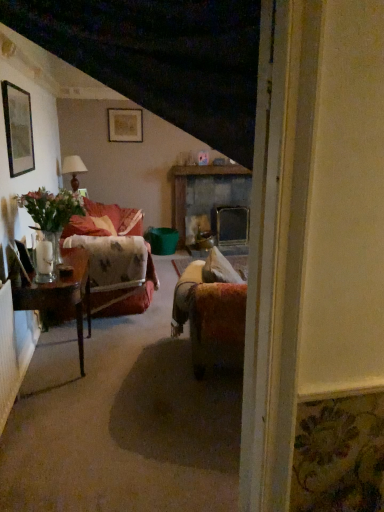
This screenshot has width=384, height=512. What do you see at coordinates (125, 125) in the screenshot?
I see `matte gold picture frame at upper center, which is the 2th picture frame from front to back` at bounding box center [125, 125].

What is the approximate width of velvet floral couch at left?

velvet floral couch at left is 3.74 feet wide.

The image size is (384, 512). What do you see at coordinates (206, 194) in the screenshot? I see `rustic stone fireplace at center` at bounding box center [206, 194].

Find the location of a particular element. This screenshot has width=384, height=512. wooden glossy table at left is located at coordinates (61, 294).

Is matte brown lamp at upper left not inside matte gold picture frame at upper center, arranged as the 2th picture frame when ordered from the bottom?

Yes, matte brown lamp at upper left is outside of matte gold picture frame at upper center, arranged as the 2th picture frame when ordered from the bottom.

Between matte brown lamp at upper left and matte gold picture frame at upper center, placed as the 1th picture frame when sorted from top to bottom, which one has less height?

matte gold picture frame at upper center, placed as the 1th picture frame when sorted from top to bottom.

From a real-world perspective, is matte brown lamp at upper left located beneath matte gold picture frame at upper center, which is the first picture frame from right to left?

Yes, from a real-world perspective, matte brown lamp at upper left is beneath matte gold picture frame at upper center, which is the first picture frame from right to left.

How many degrees apart are the facing directions of matte brown lamp at upper left and matte gold picture frame at upper center, the second picture frame positioned from the left?

88.8 degrees.

Is green matte picture frame at upper left, placed as the 1th picture frame when sorted from bottom to top, directly adjacent to matte gold picture frame at upper center, which is the first picture frame from right to left?

No, green matte picture frame at upper left, placed as the 1th picture frame when sorted from bottom to top, is not in contact with matte gold picture frame at upper center, which is the first picture frame from right to left.

Measure the distance from green matte picture frame at upper left, which is the first picture frame in left-to-right order, to matte gold picture frame at upper center, the second picture frame positioned from the left.

green matte picture frame at upper left, which is the first picture frame in left-to-right order, and matte gold picture frame at upper center, the second picture frame positioned from the left, are 2.89 meters apart from each other.

Which object is positioned more to the left, green matte picture frame at upper left, acting as the 1th picture frame starting from the front, or matte gold picture frame at upper center, arranged as the 2th picture frame when ordered from the bottom?

green matte picture frame at upper left, acting as the 1th picture frame starting from the front.

Based on the photo, is green matte picture frame at upper left, which appears as the 2th picture frame when viewed from the right, oriented towards matte gold picture frame at upper center, the second picture frame positioned from the left?

No.

At what (x,y) coordinates should I click in order to perform the action: click on lamp below the green matte picture frame at upper left, which is the first picture frame in left-to-right order (from a real-world perspective). Please return your answer as a coordinate pair (x, y). The width and height of the screenshot is (384, 512). Looking at the image, I should click on (73, 169).

From a real-world perspective, which object rests below the other?

From a 3D spatial view, matte brown lamp at upper left is below.

Does green matte picture frame at upper left, which is counted as the 2th picture frame, starting from the top, have a smaller size compared to matte brown lamp at upper left?

Yes, green matte picture frame at upper left, which is counted as the 2th picture frame, starting from the top, is smaller than matte brown lamp at upper left.

Which point is more distant from viewer, (19, 160) or (64, 162)?

The point (64, 162) is farther from the camera.

Is rustic stone fireplace at center facing towards green matte picture frame at upper left, which appears as the 2th picture frame when viewed from the right?

No, rustic stone fireplace at center is not aimed at green matte picture frame at upper left, which appears as the 2th picture frame when viewed from the right.

Is rustic stone fireplace at center directly adjacent to green matte picture frame at upper left, which ranks as the second picture frame in back-to-front order?

There is a gap between rustic stone fireplace at center and green matte picture frame at upper left, which ranks as the second picture frame in back-to-front order.

Does point (217, 191) lie behind point (25, 112)?

Yes, it is behind point (25, 112).

Consider the image. Is matte gold picture frame at upper center, which is the first picture frame from right to left, not within green matte picture frame at upper left, which ranks as the second picture frame in back-to-front order?

Yes.

Considering the relative positions of matte gold picture frame at upper center, the second picture frame positioned from the left, and green matte picture frame at upper left, which is the first picture frame in left-to-right order, in the image provided, is matte gold picture frame at upper center, the second picture frame positioned from the left, in front of green matte picture frame at upper left, which is the first picture frame in left-to-right order,?

No, matte gold picture frame at upper center, the second picture frame positioned from the left, is further to the viewer.

Considering the relative positions of matte gold picture frame at upper center, which ranks as the first picture frame in back-to-front order, and green matte picture frame at upper left, which is the first picture frame in left-to-right order, in the image provided, is matte gold picture frame at upper center, which ranks as the first picture frame in back-to-front order, to the right of green matte picture frame at upper left, which is the first picture frame in left-to-right order, from the viewer's perspective?

Yes.

Is rustic stone fireplace at center directly adjacent to matte gold picture frame at upper center, which is the 2th picture frame from front to back?

No, rustic stone fireplace at center is not next to matte gold picture frame at upper center, which is the 2th picture frame from front to back.

Who is more distant, rustic stone fireplace at center or matte gold picture frame at upper center, which is the first picture frame from right to left?

rustic stone fireplace at center is further away from the camera.

Considering the sizes of objects rustic stone fireplace at center and matte gold picture frame at upper center, which ranks as the first picture frame in back-to-front order, in the image provided, who is shorter, rustic stone fireplace at center or matte gold picture frame at upper center, which ranks as the first picture frame in back-to-front order,?

matte gold picture frame at upper center, which ranks as the first picture frame in back-to-front order, is shorter.

How different are the orientations of rustic stone fireplace at center and matte gold picture frame at upper center, which ranks as the first picture frame in back-to-front order, in degrees?

The angle between the facing direction of rustic stone fireplace at center and the facing direction of matte gold picture frame at upper center, which ranks as the first picture frame in back-to-front order, is 0.0081 degrees.

Is wooden glossy table at left not within green matte picture frame at upper left, which is counted as the 2th picture frame, starting from the top?

That's correct, wooden glossy table at left is outside of green matte picture frame at upper left, which is counted as the 2th picture frame, starting from the top.

Between wooden glossy table at left and green matte picture frame at upper left, which appears as the 2th picture frame when viewed from the right, which one has less height?

green matte picture frame at upper left, which appears as the 2th picture frame when viewed from the right, is shorter.

Can you see wooden glossy table at left touching green matte picture frame at upper left, which is counted as the 2th picture frame, starting from the top?

wooden glossy table at left and green matte picture frame at upper left, which is counted as the 2th picture frame, starting from the top, are not in contact.

Considering the relative sizes of wooden glossy table at left and green matte picture frame at upper left, acting as the 1th picture frame starting from the front, in the image provided, is wooden glossy table at left bigger than green matte picture frame at upper left, acting as the 1th picture frame starting from the front,?

Yes, wooden glossy table at left is bigger than green matte picture frame at upper left, acting as the 1th picture frame starting from the front.

Locate an element on the screen. picture frame behind the matte brown lamp at upper left is located at coordinates (125, 125).

Identify the location of picture frame that appears below the matte gold picture frame at upper center, which ranks as the first picture frame in back-to-front order (from a real-world perspective). (18, 129).

Considering their positions, is matte brown lamp at upper left positioned further to velvet floral couch at left than matte gold picture frame at upper center, which is the 2th picture frame from front to back?

matte gold picture frame at upper center, which is the 2th picture frame from front to back.

From the image, which object appears to be farther from matte gold picture frame at upper center, which is the 2th picture frame from front to back, matte brown lamp at upper left or wooden glossy table at left?

wooden glossy table at left is positioned further to the anchor matte gold picture frame at upper center, which is the 2th picture frame from front to back.

When comparing their distances from rustic stone fireplace at center, does matte brown lamp at upper left or green matte picture frame at upper left, which is counted as the 2th picture frame, starting from the top, seem closer?

matte brown lamp at upper left is positioned closer to the anchor rustic stone fireplace at center.

Which object lies further to the anchor point wooden glossy table at left, matte gold picture frame at upper center, arranged as the 2th picture frame when ordered from the bottom, or green matte picture frame at upper left, which is counted as the 2th picture frame, starting from the top?

matte gold picture frame at upper center, arranged as the 2th picture frame when ordered from the bottom, is further to wooden glossy table at left.

When comparing their distances from velvet floral couch at left, does wooden glossy table at left or matte brown lamp at upper left seem further?

matte brown lamp at upper left is further to velvet floral couch at left.

Looking at the image, which one is located closer to matte gold picture frame at upper center, the second picture frame positioned from the left, matte brown lamp at upper left or green matte picture frame at upper left, which ranks as the second picture frame in back-to-front order?

Based on the image, matte brown lamp at upper left appears to be nearer to matte gold picture frame at upper center, the second picture frame positioned from the left.

From the image, which object appears to be nearer to green matte picture frame at upper left, which is counted as the 2th picture frame, starting from the top, velvet floral couch at left or matte gold picture frame at upper center, the second picture frame positioned from the left?

velvet floral couch at left is closer to green matte picture frame at upper left, which is counted as the 2th picture frame, starting from the top.

From the image, which object appears to be nearer to rustic stone fireplace at center, wooden glossy table at left or matte gold picture frame at upper center, the second picture frame positioned from the left?

matte gold picture frame at upper center, the second picture frame positioned from the left, is positioned closer to the anchor rustic stone fireplace at center.

Where is `couch between wooden glossy table at left and rustic stone fireplace at center along the z-axis`? The image size is (384, 512). couch between wooden glossy table at left and rustic stone fireplace at center along the z-axis is located at coordinates (122, 289).

This screenshot has height=512, width=384. Identify the location of lamp positioned between green matte picture frame at upper left, which ranks as the second picture frame in back-to-front order, and matte gold picture frame at upper center, placed as the 1th picture frame when sorted from top to bottom, from near to far. (73, 169).

Locate an element on the screen. The width and height of the screenshot is (384, 512). couch between green matte picture frame at upper left, which is counted as the 2th picture frame, starting from the top, and rustic stone fireplace at center from front to back is located at coordinates (122, 289).

Image resolution: width=384 pixels, height=512 pixels. Identify the location of lamp between green matte picture frame at upper left, acting as the 1th picture frame starting from the front, and rustic stone fireplace at center from front to back. (73, 169).